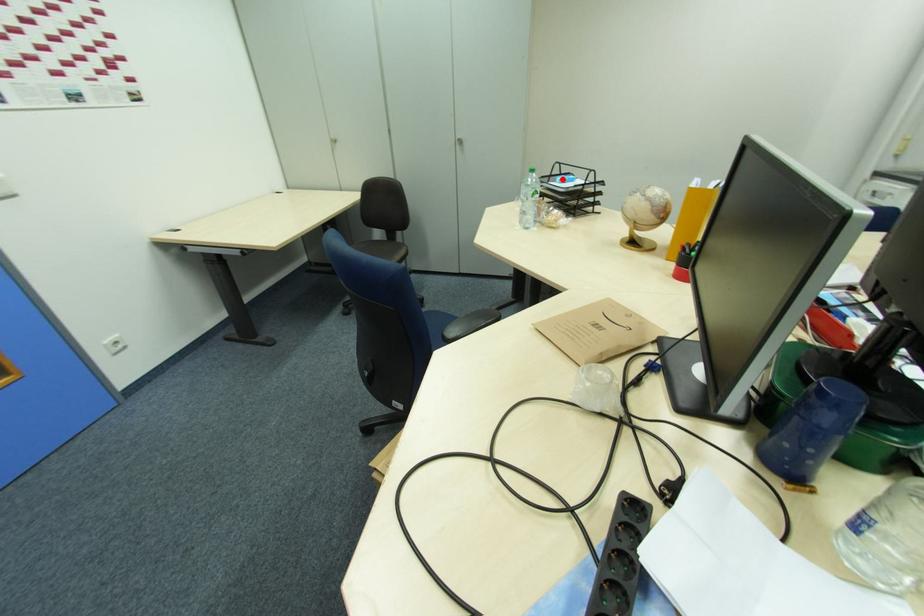
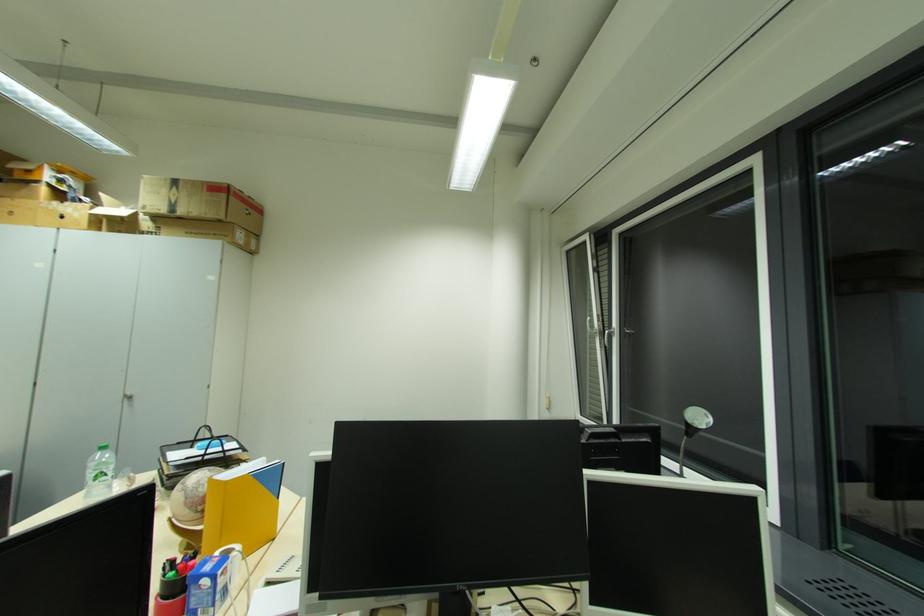
In the second image, find the point that corresponds to the highlighted location in the first image.

(202, 445)